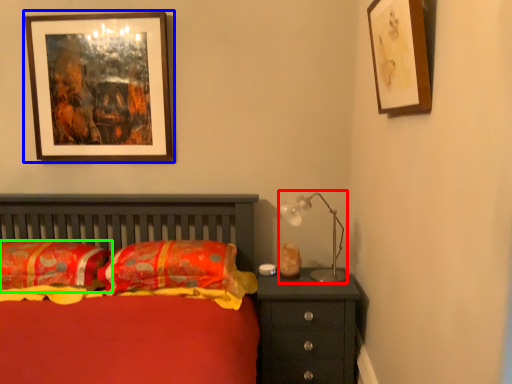
Question: Which object is positioned closest to table lamp (highlighted by a red box)? Select from picture frame (highlighted by a blue box) and pillow (highlighted by a green box).

Choices:
 (A) picture frame
 (B) pillow

Answer: (B)